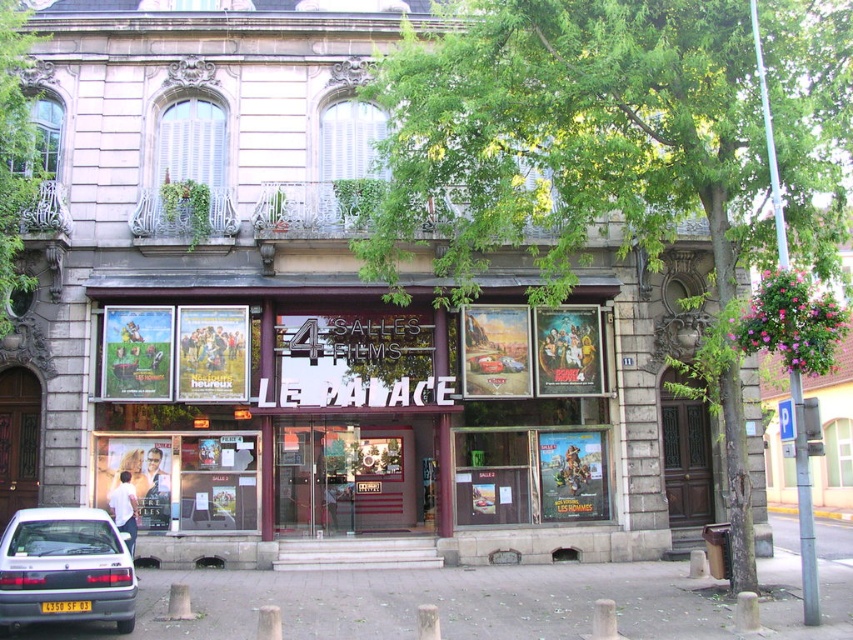
Question: Considering the relative positions of silver metallic hatchback at lower left and white wooden shutters at upper center in the image provided, where is silver metallic hatchback at lower left located with respect to white wooden shutters at upper center?

Choices:
 (A) below
 (B) above

Answer: (A)

Question: Which point is closer to the camera?

Choices:
 (A) green leafy plant at upper center
 (B) metallic glass windows at center
 (C) white wooden shutters at upper center
 (D) silver metallic hatchback at lower left

Answer: (D)

Question: Can you confirm if silver metallic hatchback at lower left is smaller than green leafy plant at upper center?

Choices:
 (A) no
 (B) yes

Answer: (B)

Question: Which point is closer to the camera taking this photo?

Choices:
 (A) (102, 513)
 (B) (329, 212)

Answer: (A)

Question: Can you confirm if metallic glass windows at center is thinner than silver metallic hatchback at lower left?

Choices:
 (A) no
 (B) yes

Answer: (A)

Question: Which point is farther from the camera taking this photo?

Choices:
 (A) (346, 145)
 (B) (169, 152)

Answer: (A)